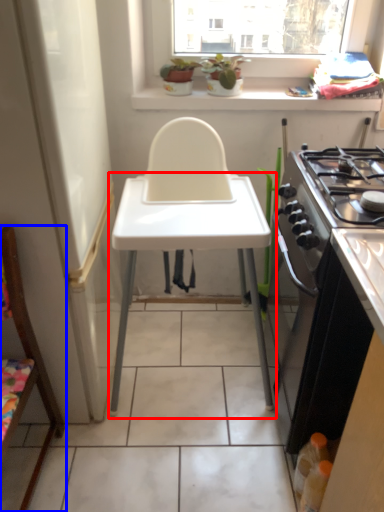
Question: Among these objects, which one is farthest to the camera, changing table (highlighted by a red box) or chair (highlighted by a blue box)?

Choices:
 (A) changing table
 (B) chair

Answer: (A)